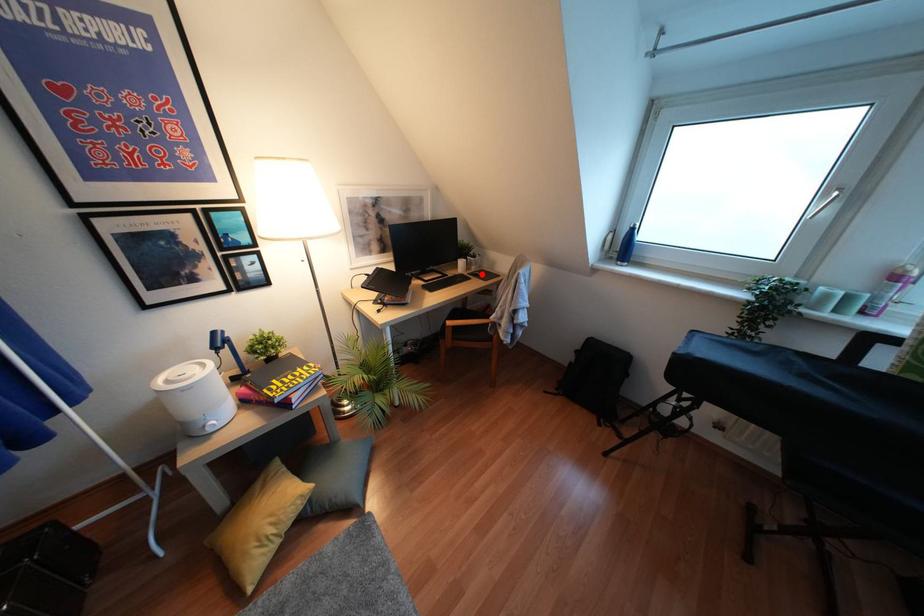
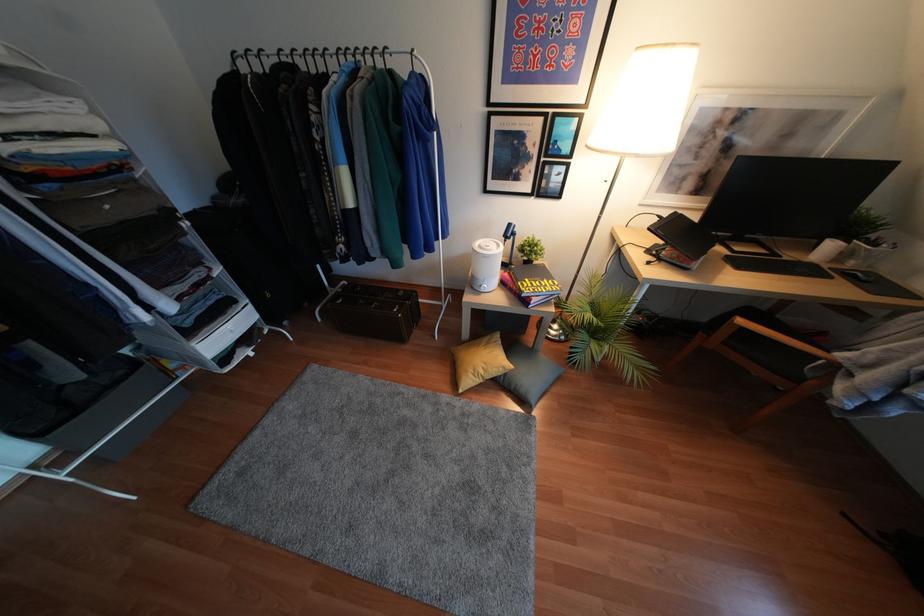
Locate, in the second image, the point that corresponds to the highlighted location in the first image.

(868, 281)